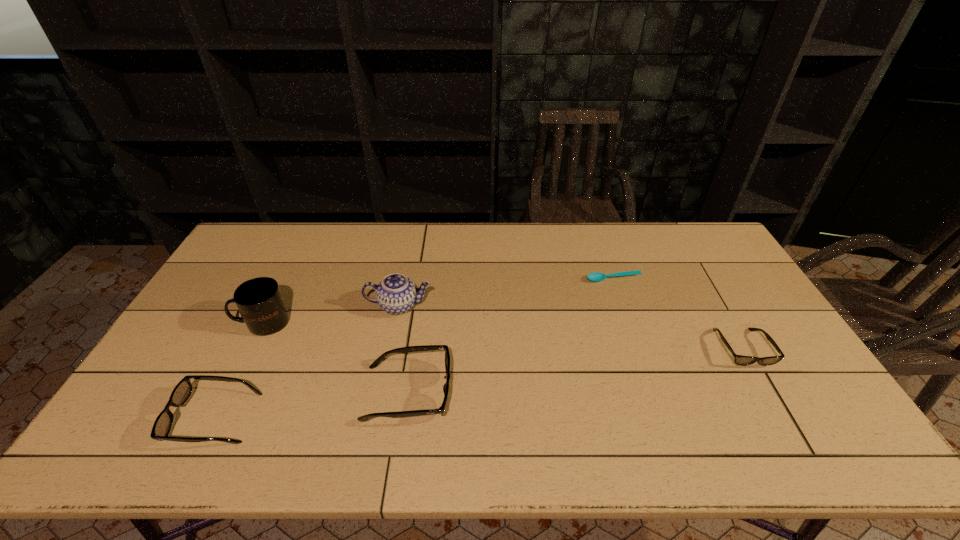
The width and height of the screenshot is (960, 540). What are the coordinates of `free space between the chinaware and the mug` in the screenshot? It's located at (331, 314).

Identify the location of free space between the mug and the third tallest object. (335, 357).

Identify the location of free space between the second spectacles from left to right and the second tallest spectacles. This screenshot has height=540, width=960. (311, 406).

At what (x,y) coordinates should I click in order to perform the action: click on vacant space that's between the mug and the chinaware. Please return your answer as a coordinate pair (x, y). The width and height of the screenshot is (960, 540). Looking at the image, I should click on (331, 314).

The height and width of the screenshot is (540, 960). I want to click on unoccupied area between the mug and the chinaware, so tap(331, 314).

The height and width of the screenshot is (540, 960). I want to click on free spot between the mug and the rightmost object, so click(503, 335).

Identify which object is the fifth closest to the mug. Please provide its 2D coordinates. Your answer should be formatted as a tuple, i.e. [(x, y)], where the tuple contains the x and y coordinates of a point satisfying the conditions above.

[(738, 359)]

Find the location of a particular element. The image size is (960, 540). object that is the second nearest to the mug is located at coordinates (396, 294).

Locate which spectacles is the second closest to the second shortest object. Please provide its 2D coordinates. Your answer should be formatted as a tuple, i.e. [(x, y)], where the tuple contains the x and y coordinates of a point satisfying the conditions above.

[(182, 391)]

The height and width of the screenshot is (540, 960). What are the coordinates of `spectacles that stands as the third closest to the chinaware` in the screenshot? It's located at [x=738, y=359].